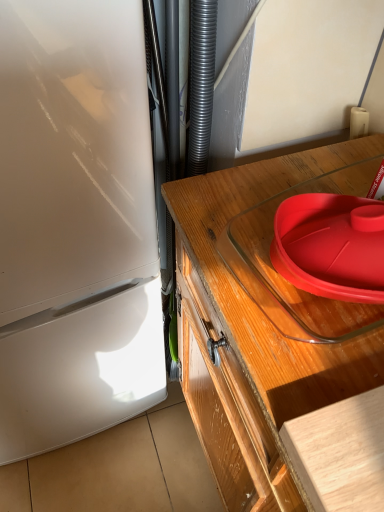
Question: Considering the relative positions of transparent glass tray at upper right and red plastic lid at upper right in the image provided, is transparent glass tray at upper right to the right of red plastic lid at upper right from the viewer's perspective?

Choices:
 (A) yes
 (B) no

Answer: (B)

Question: From a real-world perspective, is transparent glass tray at upper right located higher than red plastic lid at upper right?

Choices:
 (A) no
 (B) yes

Answer: (A)

Question: Is transparent glass tray at upper right bigger than red plastic lid at upper right?

Choices:
 (A) yes
 (B) no

Answer: (A)

Question: Is transparent glass tray at upper right positioned with its back to red plastic lid at upper right?

Choices:
 (A) no
 (B) yes

Answer: (A)

Question: Is transparent glass tray at upper right oriented towards red plastic lid at upper right?

Choices:
 (A) yes
 (B) no

Answer: (B)

Question: Considering the relative sizes of transparent glass tray at upper right and red plastic lid at upper right in the image provided, is transparent glass tray at upper right thinner than red plastic lid at upper right?

Choices:
 (A) yes
 (B) no

Answer: (B)

Question: Would you say red plastic lid at upper right is a long distance from transparent glass tray at upper right?

Choices:
 (A) yes
 (B) no

Answer: (B)

Question: Is red plastic lid at upper right facing towards transparent glass tray at upper right?

Choices:
 (A) yes
 (B) no

Answer: (B)

Question: Is red plastic lid at upper right to the right of transparent glass tray at upper right from the viewer's perspective?

Choices:
 (A) yes
 (B) no

Answer: (A)

Question: Is transparent glass tray at upper right surrounded by red plastic lid at upper right?

Choices:
 (A) no
 (B) yes

Answer: (A)

Question: Does red plastic lid at upper right have a smaller size compared to transparent glass tray at upper right?

Choices:
 (A) yes
 (B) no

Answer: (A)

Question: Considering the relative positions of red plastic lid at upper right and transparent glass tray at upper right in the image provided, is red plastic lid at upper right to the left of transparent glass tray at upper right from the viewer's perspective?

Choices:
 (A) no
 (B) yes

Answer: (A)

Question: Is transparent glass tray at upper right wider or thinner than red plastic lid at upper right?

Choices:
 (A) wide
 (B) thin

Answer: (A)